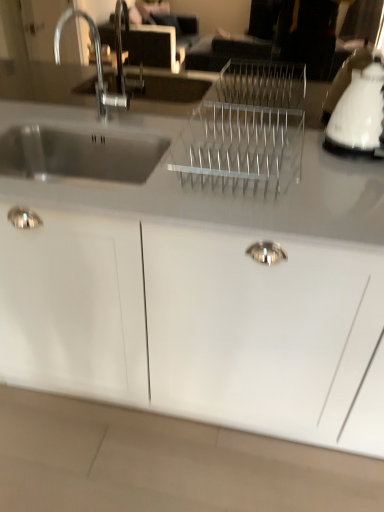
Describe the element at coordinates (198, 325) in the screenshot. I see `white glossy cabinet at center` at that location.

Where is `white glossy cabinet at center`? The width and height of the screenshot is (384, 512). white glossy cabinet at center is located at coordinates (198, 325).

Measure the distance between white glossy cabinet at center and camera.

white glossy cabinet at center and camera are 34.97 inches apart from each other.

The image size is (384, 512). Find the location of `white glossy kettle at upper right`. white glossy kettle at upper right is located at coordinates (360, 111).

Describe the element at coordinates (360, 111) in the screenshot. I see `white glossy kettle at upper right` at that location.

I want to click on white glossy cabinet at center, so click(x=198, y=325).

Considering the positions of objects white glossy kettle at upper right and white glossy cabinet at center in the image provided, who is more to the right, white glossy kettle at upper right or white glossy cabinet at center?

white glossy kettle at upper right.

Which object is further away from the camera taking this photo, white glossy kettle at upper right or white glossy cabinet at center?

white glossy kettle at upper right is behind.

Does point (377, 148) lie in front of point (134, 360)?

Yes, it is in front of point (134, 360).

From the image's perspective, is white glossy kettle at upper right on white glossy cabinet at center?

Yes, from the image's perspective, white glossy kettle at upper right is above white glossy cabinet at center.

From a real-world perspective, is white glossy kettle at upper right beneath white glossy cabinet at center?

No.

Considering the sizes of white glossy kettle at upper right and white glossy cabinet at center in the image, is white glossy kettle at upper right wider or thinner than white glossy cabinet at center?

Clearly, white glossy kettle at upper right has less width compared to white glossy cabinet at center.

Who is taller, white glossy kettle at upper right or white glossy cabinet at center?

With more height is white glossy cabinet at center.

Considering the sizes of objects white glossy kettle at upper right and white glossy cabinet at center in the image provided, who is bigger, white glossy kettle at upper right or white glossy cabinet at center?

white glossy cabinet at center.

Choose the correct answer: Is white glossy kettle at upper right inside white glossy cabinet at center or outside it?

white glossy kettle at upper right exists outside the volume of white glossy cabinet at center.

Would you say white glossy kettle at upper right is a long distance from white glossy cabinet at center?

white glossy kettle at upper right is near white glossy cabinet at center, not far away.

Is white glossy kettle at upper right facing away from white glossy cabinet at center?

No.

What's the angular difference between white glossy kettle at upper right and white glossy cabinet at center's facing directions?

1.24 degrees separate the facing orientations of white glossy kettle at upper right and white glossy cabinet at center.

Where is `appliance above the white glossy cabinet at center (from a real-world perspective)`? appliance above the white glossy cabinet at center (from a real-world perspective) is located at coordinates (360, 111).

Is white glossy cabinet at center to the right of white glossy kettle at upper right from the viewer's perspective?

In fact, white glossy cabinet at center is to the left of white glossy kettle at upper right.

Considering the positions of objects white glossy cabinet at center and white glossy kettle at upper right in the image provided, who is in front, white glossy cabinet at center or white glossy kettle at upper right?

Positioned in front is white glossy cabinet at center.

Which point is more distant from viewer, (71, 226) or (370, 125)?

Positioned behind is point (370, 125).

From the image's perspective, is white glossy cabinet at center positioned above or below white glossy kettle at upper right?

Clearly, from the image's perspective, white glossy cabinet at center is below white glossy kettle at upper right.

Looking at this image, from a real-world perspective, is white glossy cabinet at center on white glossy kettle at upper right?

No, from a real-world perspective, white glossy cabinet at center is not on top of white glossy kettle at upper right.

In terms of width, does white glossy cabinet at center look wider or thinner when compared to white glossy kettle at upper right?

Considering their sizes, white glossy cabinet at center looks broader than white glossy kettle at upper right.

Does white glossy cabinet at center have a greater height compared to white glossy kettle at upper right?

Yes, white glossy cabinet at center is taller than white glossy kettle at upper right.

Between white glossy cabinet at center and white glossy kettle at upper right, which one has larger size?

Bigger between the two is white glossy cabinet at center.

Choose the correct answer: Is white glossy cabinet at center inside white glossy kettle at upper right or outside it?

white glossy cabinet at center is spatially situated outside white glossy kettle at upper right.

Would you consider white glossy cabinet at center to be distant from white glossy kettle at upper right?

They are positioned close to each other.

Is white glossy cabinet at center turned away from white glossy kettle at upper right?

white glossy cabinet at center does not have its back to white glossy kettle at upper right.

Can you tell me how much white glossy cabinet at center and white glossy kettle at upper right differ in facing direction?

white glossy cabinet at center and white glossy kettle at upper right are facing 1.24 degrees away from each other.

Identify the location of appliance that appears above the white glossy cabinet at center (from a real-world perspective). (360, 111).

At what (x,y) coordinates should I click in order to perform the action: click on appliance above the white glossy cabinet at center (from the image's perspective). Please return your answer as a coordinate pair (x, y). Looking at the image, I should click on (360, 111).

Where is `appliance located behind the white glossy cabinet at center`? appliance located behind the white glossy cabinet at center is located at coordinates (360, 111).